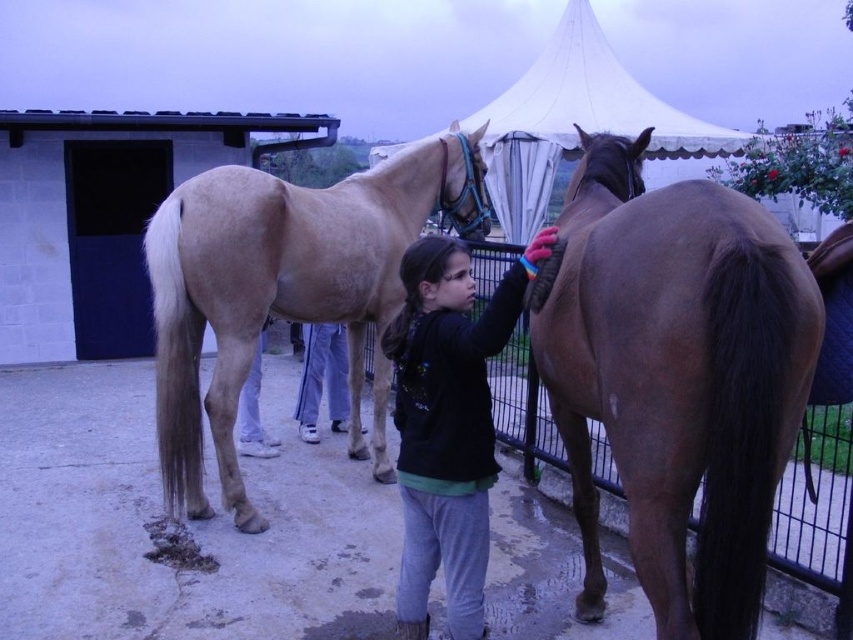
Question: Which of these objects is positioned closest to the white cotton pants at center?

Choices:
 (A) white fabric pants at lower center
 (B) light brown glossy horse at center

Answer: (A)

Question: Considering the relative positions of black fleece jacket at center and white fabric pants at lower center in the image provided, where is black fleece jacket at center located with respect to white fabric pants at lower center?

Choices:
 (A) below
 (B) above

Answer: (A)

Question: Which point is farther to the camera?

Choices:
 (A) (335, 401)
 (B) (259, 349)
 (C) (569, 320)
 (D) (369, 282)

Answer: (A)

Question: Is white cotton pants at center bigger than white fabric pants at lower center?

Choices:
 (A) yes
 (B) no

Answer: (B)

Question: Among these points, which one is farthest from the camera?

Choices:
 (A) (334, 380)
 (B) (564, 280)

Answer: (A)

Question: Can you confirm if brown matte horse at right is positioned to the left of black fleece jacket at center?

Choices:
 (A) no
 (B) yes

Answer: (A)